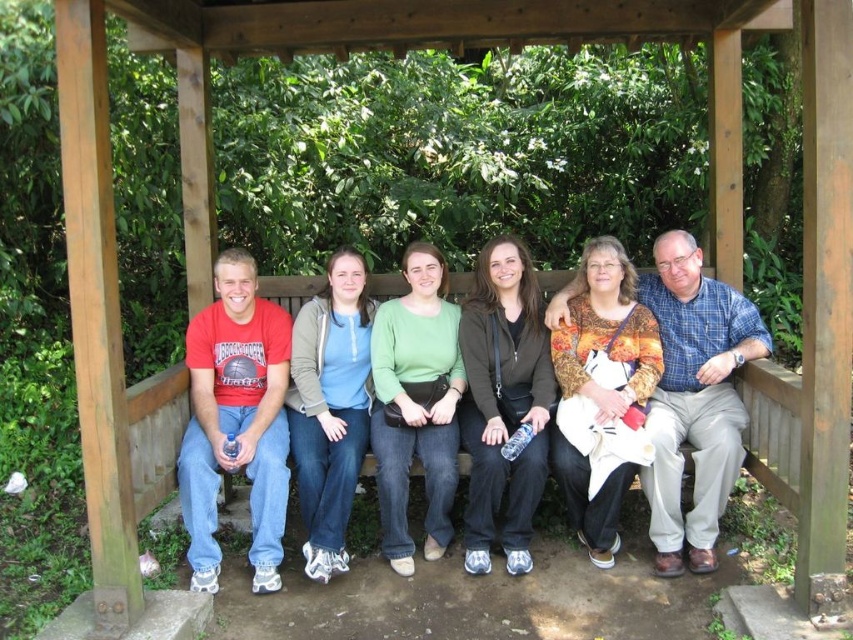
Is printed fabric blouse at center smaller than matte brown jacket at center?

Actually, printed fabric blouse at center might be larger than matte brown jacket at center.

Can you confirm if printed fabric blouse at center is positioned below matte brown jacket at center?

No.

Between point (589, 380) and point (490, 534), which one is positioned behind?

Point (589, 380)

The image size is (853, 640). Find the location of `printed fabric blouse at center`. printed fabric blouse at center is located at coordinates (602, 394).

Is matte black bench at center positioned at the back of green matte sweater at center?

No, matte black bench at center is in front of green matte sweater at center.

What do you see at coordinates (636, 336) in the screenshot? The height and width of the screenshot is (640, 853). I see `matte black bench at center` at bounding box center [636, 336].

Identify the location of matte black bench at center. [636, 336].

Between point (605, 417) and point (538, 451), which one is positioned behind?

The point (605, 417) is more distant.

Which of these two, matte black bench at center or matte brown jacket at center, stands shorter?

matte brown jacket at center

Which is behind, point (485, 422) or point (532, 275)?

The point (532, 275) is more distant.

Where is `matte black bench at center`? The width and height of the screenshot is (853, 640). matte black bench at center is located at coordinates (636, 336).